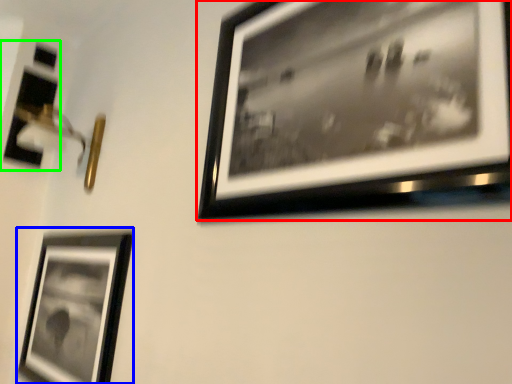
Question: Estimate the real-world distances between objects in this image. Which object is closer to picture frame (highlighted by a red box), picture frame (highlighted by a blue box) or picture frame (highlighted by a green box)?

Choices:
 (A) picture frame
 (B) picture frame

Answer: (A)